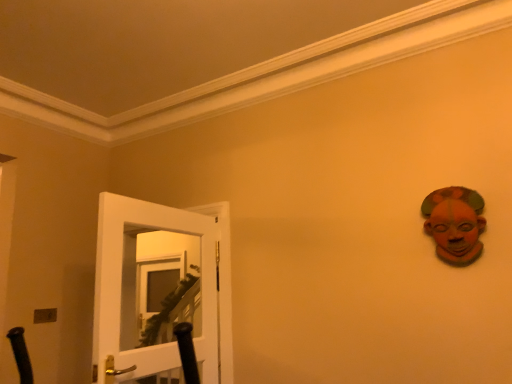
Question: Is terracotta clay mask at upper right located within white glossy door at left?

Choices:
 (A) yes
 (B) no

Answer: (B)

Question: From the image's perspective, is white glossy door at left located above terracotta clay mask at upper right?

Choices:
 (A) no
 (B) yes

Answer: (A)

Question: Considering the relative positions of white glossy door at left and terracotta clay mask at upper right in the image provided, is white glossy door at left to the right of terracotta clay mask at upper right from the viewer's perspective?

Choices:
 (A) yes
 (B) no

Answer: (B)

Question: Does white glossy door at left appear on the left side of terracotta clay mask at upper right?

Choices:
 (A) no
 (B) yes

Answer: (B)

Question: Would you consider white glossy door at left to be distant from terracotta clay mask at upper right?

Choices:
 (A) yes
 (B) no

Answer: (A)

Question: Considering the relative sizes of white glossy door at left and terracotta clay mask at upper right in the image provided, is white glossy door at left shorter than terracotta clay mask at upper right?

Choices:
 (A) no
 (B) yes

Answer: (A)

Question: Does metallic silver light switch at lower left lie behind terracotta clay mask at upper right?

Choices:
 (A) yes
 (B) no

Answer: (A)

Question: From a real-world perspective, is metallic silver light switch at lower left on top of terracotta clay mask at upper right?

Choices:
 (A) yes
 (B) no

Answer: (B)

Question: Is metallic silver light switch at lower left closer to camera compared to terracotta clay mask at upper right?

Choices:
 (A) no
 (B) yes

Answer: (A)

Question: From the image's perspective, is metallic silver light switch at lower left above terracotta clay mask at upper right?

Choices:
 (A) no
 (B) yes

Answer: (A)

Question: Is metallic silver light switch at lower left at the right side of terracotta clay mask at upper right?

Choices:
 (A) no
 (B) yes

Answer: (A)

Question: Is metallic silver light switch at lower left shorter than terracotta clay mask at upper right?

Choices:
 (A) no
 (B) yes

Answer: (B)

Question: Is white glossy door at left to the left of metallic silver light switch at lower left from the viewer's perspective?

Choices:
 (A) yes
 (B) no

Answer: (B)